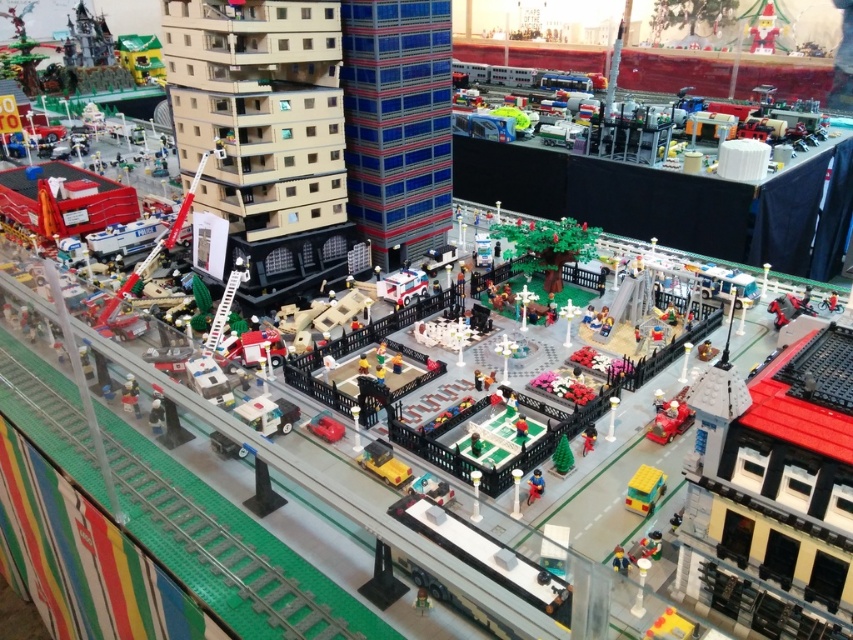
You are a visitor at the Lego exhibition and want to know if the yellow matte bus at lower right can fit through a doorway designed for the smooth plastic figure at lower right. Can it?

The yellow matte bus at lower right is much taller than the smooth plastic figure at lower right, so it cannot fit through the doorway designed for the smooth plastic figure at lower right.

You are a Lego figure standing on the green baseplate street in the Lego cityscape. You need to transport an injured Lego person to the hospital. Which vehicle, the white plastic ambulance at center or the smooth plastic bicycle at center, should you choose and why?

You should choose the white plastic ambulance at center because it is larger in size than the smooth plastic bicycle at center, making it more suitable for transporting an injured Lego person to the hospital.